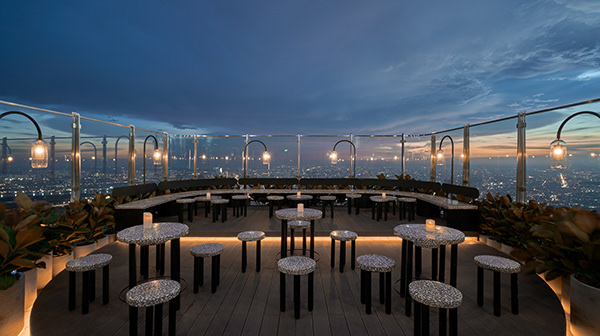
Identify the location of stools. (160, 292), (191, 252), (291, 265), (429, 283), (376, 269).